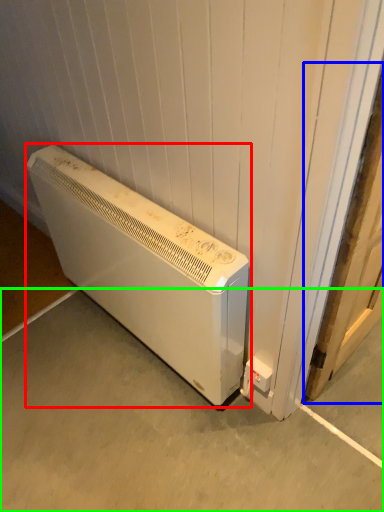
Question: Which object is the farthest from home appliance (highlighted by a red box)? Choose among these: door (highlighted by a blue box) or concrete (highlighted by a green box).

Choices:
 (A) door
 (B) concrete

Answer: (A)